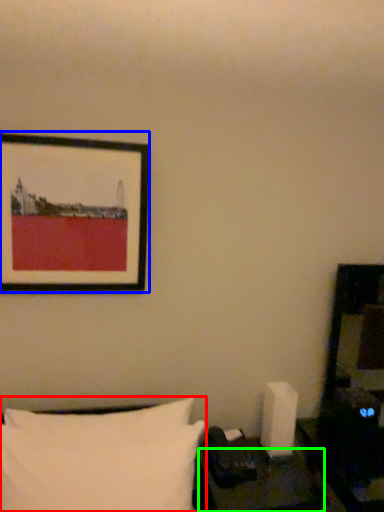
Question: Estimate the real-world distances between objects in this image. Which object is farther from pillow (highlighted by a red box), picture frame (highlighted by a blue box) or table (highlighted by a green box)?

Choices:
 (A) picture frame
 (B) table

Answer: (A)